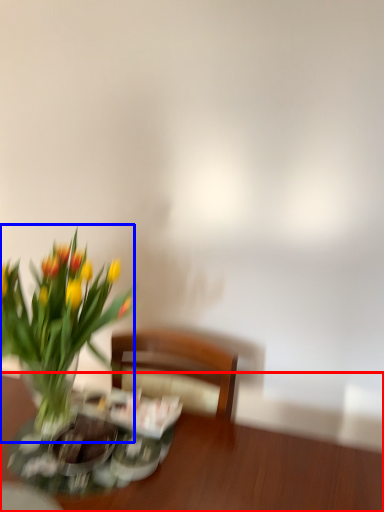
Question: Among these objects, which one is farthest to the camera, table (highlighted by a red box) or flower (highlighted by a blue box)?

Choices:
 (A) table
 (B) flower

Answer: (A)